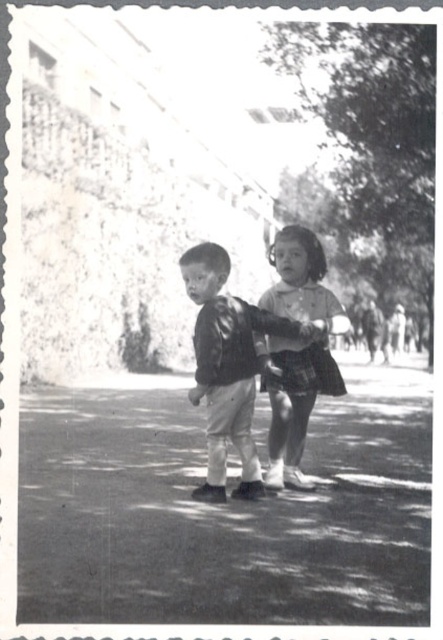
In the scene shown: You are a photographer trying to capture a closeup shot of the leather jacket at center and the plaid fabric dress at center. The camera you are using has a minimum focus distance of 2.5 inches. Can you focus on both items simultaneously without moving the camera?

The leather jacket at center and plaid fabric dress at center are 3.01 inches apart, so yes, the camera can focus on both items simultaneously since the distance between them is greater than the minimum focus distance of 2.5 inches.

Looking at this image, based on the scene described, which object, the leather jacket at center or the plaid fabric dress at center, would require more space to store in a closet? Explain your reasoning using the provided information.

The leather jacket at center would require more space to store in a closet because it is larger in size than the plaid fabric dress at center according to the description.

You are a photographer adjusting your camera settings to focus on two specific points in the image. The points are labeled as point 1 at coordinates point (221, 376) and point 2 at coordinates point (318, 304). Which point should you focus on first if you want to ensure both points are in focus, considering their depth from the camera?

You should focus on point (221, 376) first because it is closer to the camera than point (318, 304). By focusing on the closer point, the farther point will also be within the depth of field if the aperture is set appropriately.